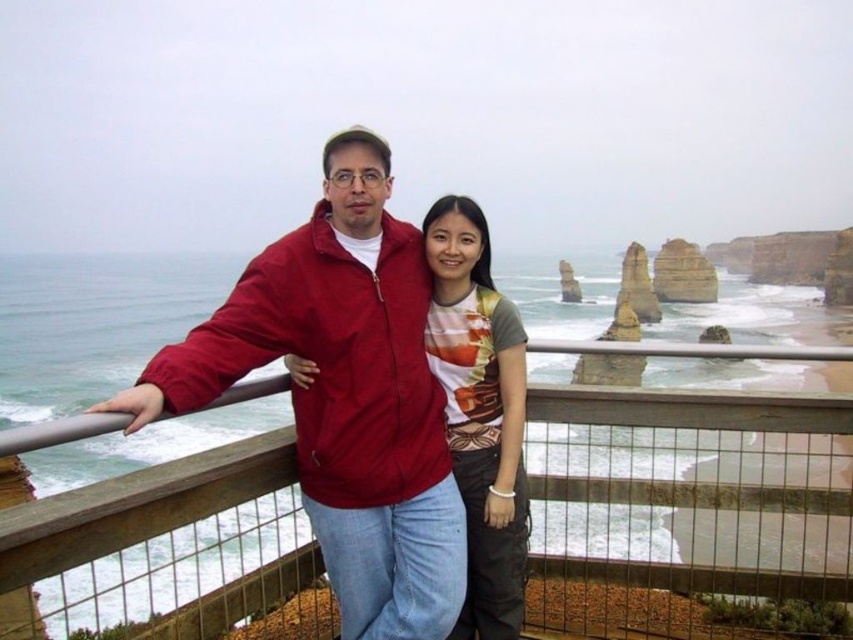
You are a photographer trying to capture a photo of the wooden at center and the matte red jacket at center. Which object should you adjust your camera to focus on first if you want to include both in the frame without moving the camera?

The wooden at center is to the right of matte red jacket at center, so you should focus on the matte red jacket at center first as it is closer to the left side, allowing the wooden at center to naturally fall into the frame on the right without needing to reposition the camera.